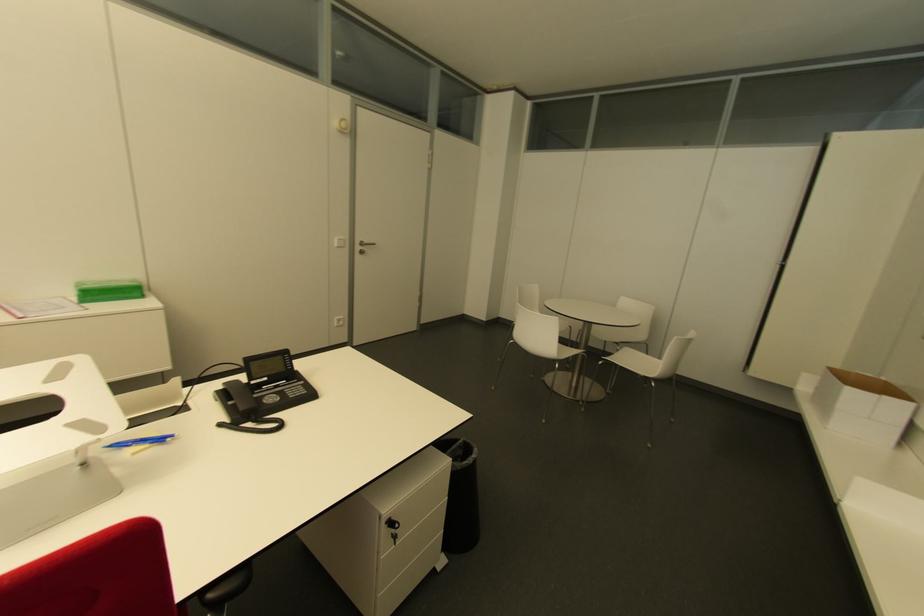
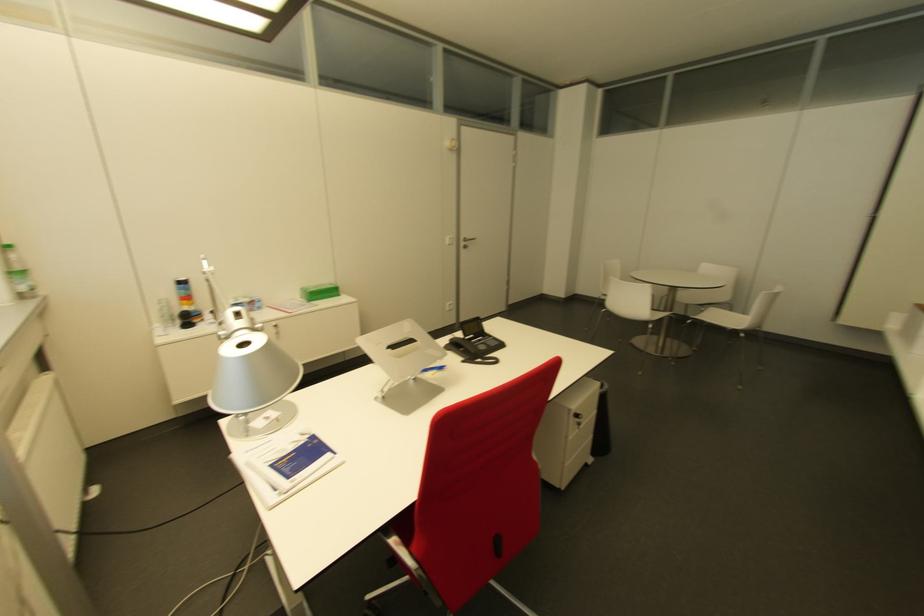
The point at (360,253) is marked in the first image. Where is the corresponding point in the second image?

(463, 246)